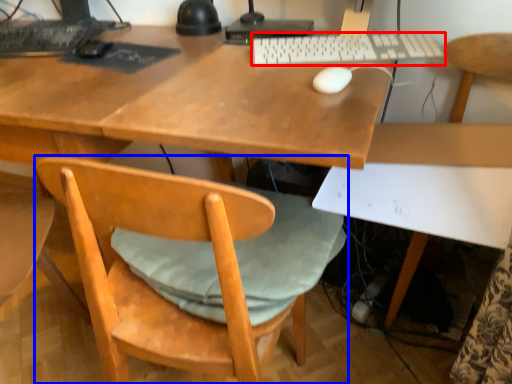
Question: Which object appears closest to the camera in this image, computer keyboard (highlighted by a red box) or chair (highlighted by a blue box)?

Choices:
 (A) computer keyboard
 (B) chair

Answer: (B)